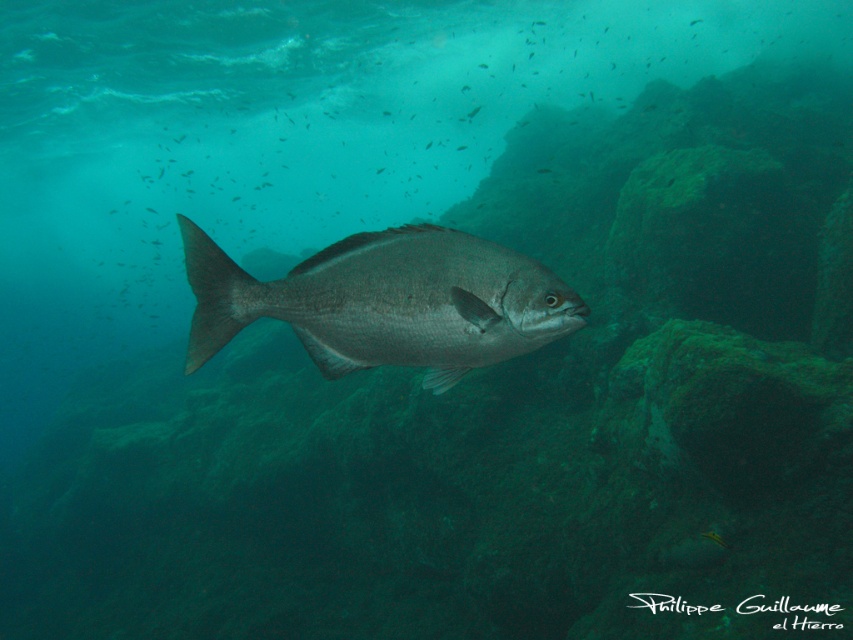
Who is more distant from viewer, [424,342] or [635,221]?

Point [635,221]

Who is positioned more to the right, silvery metallic fish at center or smooth rock at center?

From the viewer's perspective, smooth rock at center appears more on the right side.

Is point (306, 294) less distant than point (639, 200)?

Yes, point (306, 294) is closer to viewer.

Find the location of a particular element. Image resolution: width=853 pixels, height=640 pixels. silvery metallic fish at center is located at coordinates (386, 301).